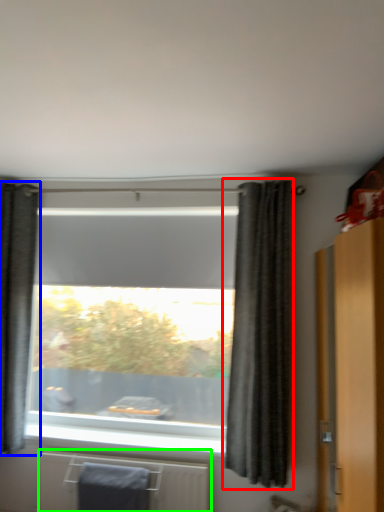
Question: Considering the real-world distances, which object is farthest from curtain (highlighted by a red box)? curtain (highlighted by a blue box) or radiator (highlighted by a green box)?

Choices:
 (A) curtain
 (B) radiator

Answer: (A)